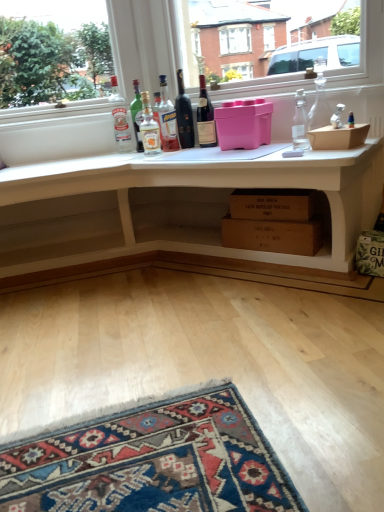
Locate an element on the screen. The image size is (384, 512). vacant space that is to the left of green paper bag at lower right is located at coordinates (334, 293).